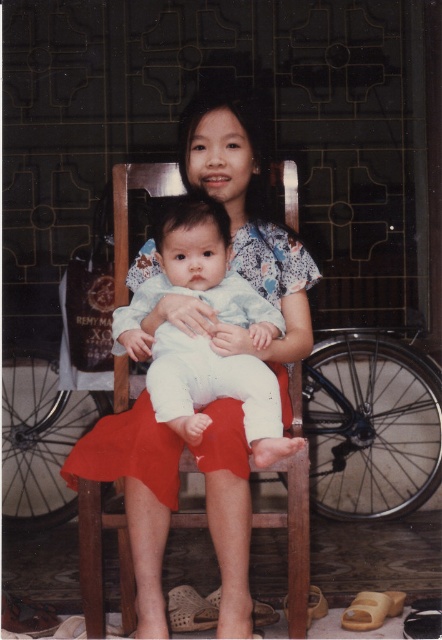
Can you confirm if matte floral dress at center is positioned below light blue fabric baby at center?

Indeed, matte floral dress at center is positioned under light blue fabric baby at center.

Does point (279, 355) come in front of point (179, 365)?

No, it is not.

Identify the location of matte floral dress at center. (240, 234).